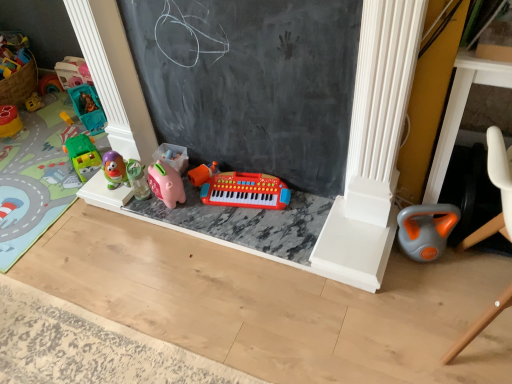
Where is `free location to the right of rubberized green car at left, which ranks as the first toy in left-to-right order`? The height and width of the screenshot is (384, 512). free location to the right of rubberized green car at left, which ranks as the first toy in left-to-right order is located at coordinates (39, 124).